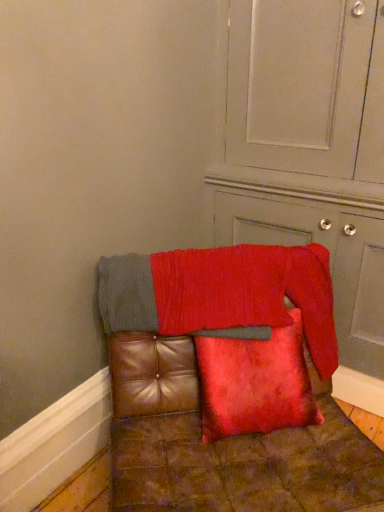
Question: Does point (241, 364) appear closer or farther from the camera than point (264, 151)?

Choices:
 (A) farther
 (B) closer

Answer: (B)

Question: Based on their positions, is velvet red pillow at center located to the left or right of velvet red cushion at lower right?

Choices:
 (A) left
 (B) right

Answer: (A)

Question: Estimate the real-world distances between objects in this image. Which object is closer to the leather cushion at center?

Choices:
 (A) velvet red cushion at lower right
 (B) velvet red pillow at center
 (C) red textured blanket at center

Answer: (B)

Question: Considering the real-world distances, which object is closest to the red textured blanket at center?

Choices:
 (A) leather cushion at center
 (B) velvet red pillow at center
 (C) velvet red cushion at lower right

Answer: (A)